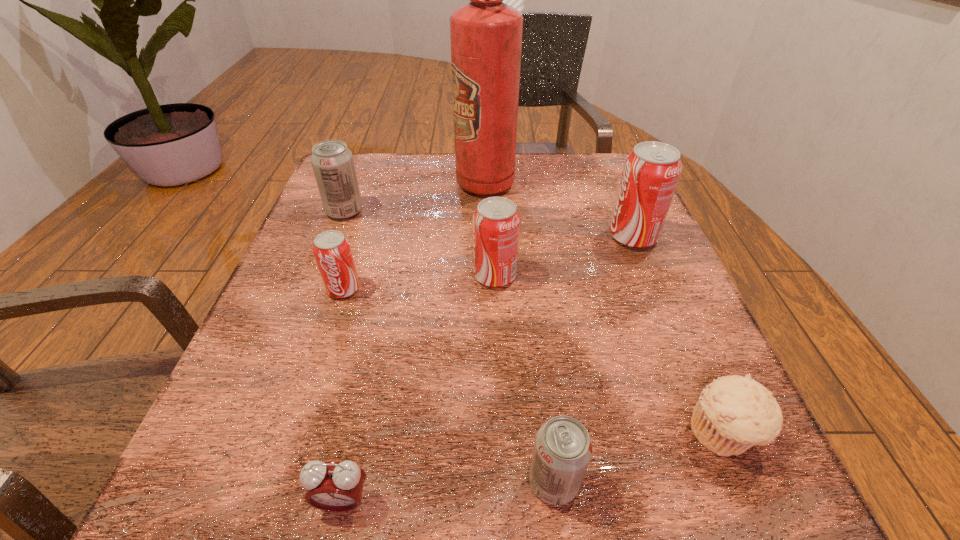
The image size is (960, 540). I want to click on soda can that is the closest to the farther gray soda can, so click(331, 249).

This screenshot has width=960, height=540. Find the location of `soda can identified as the third closest to the seventh nearest object`. soda can identified as the third closest to the seventh nearest object is located at coordinates (651, 172).

Identify the location of red soda can that stands as the third closest to the fire extinguisher. The image size is (960, 540). (331, 249).

Locate an element on the screen. The width and height of the screenshot is (960, 540). red soda can object that ranks as the third closest to the left gray soda can is located at coordinates (651, 172).

The image size is (960, 540). What are the coordinates of `vacant region that satisfies the following two spatial constraints: 1. on the logo side of the smaller gray soda can; 2. on the right side of the second red soda can from right to left` in the screenshot? It's located at (502, 482).

Image resolution: width=960 pixels, height=540 pixels. I want to click on free space that satisfies the following two spatial constraints: 1. on the logo side of the muffin; 2. on the right side of the leftmost red soda can, so click(297, 433).

In order to click on free point that satisfies the following two spatial constraints: 1. on the logo side of the smallest red soda can; 2. on the left side of the smaller gray soda can in this screenshot , I will do `click(281, 482)`.

At what (x,y) coordinates should I click in order to perform the action: click on free space that satisfies the following two spatial constraints: 1. on the label side of the red fire extinguisher; 2. on the back side of the right gray soda can. Please return your answer as a coordinate pair (x, y). Looking at the image, I should click on (490, 482).

I want to click on free point that satisfies the following two spatial constraints: 1. on the logo side of the second red soda can from left to right; 2. on the clock face of the alarm clock, so click(503, 501).

This screenshot has width=960, height=540. Identify the location of blank space that satisfies the following two spatial constraints: 1. on the logo side of the muffin; 2. on the left side of the smallest red soda can. (297, 433).